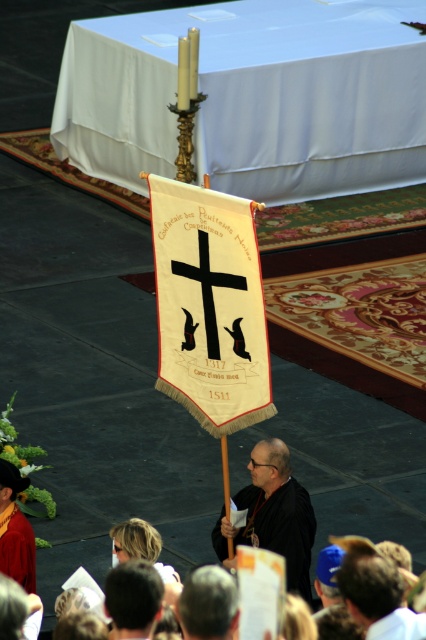
Question: Observing the image, what is the correct spatial positioning of gray hair at lower center in reference to black fabric cross at center?

Choices:
 (A) left
 (B) right

Answer: (B)

Question: Can you confirm if gold textured banner at center is positioned to the right of gray hair at lower center?

Choices:
 (A) yes
 (B) no

Answer: (B)

Question: Among these objects, which one is farthest from the camera?

Choices:
 (A) gray hair at lower center
 (B) black fabric cross at center

Answer: (B)

Question: Observing the image, what is the correct spatial positioning of black matte robe at center in reference to gray hair at lower center?

Choices:
 (A) right
 (B) left

Answer: (A)

Question: Which object appears closest to the camera in this image?

Choices:
 (A) dark brown leather hat at lower right
 (B) dark brown hair at lower center
 (C) black fabric cross at center
 (D) gray hair at lower center

Answer: (D)

Question: Which object is closer to the camera taking this photo?

Choices:
 (A) gray hair at lower center
 (B) dark brown leather hat at lower right
 (C) dark brown hair at lower center
 (D) black fabric cross at center

Answer: (A)